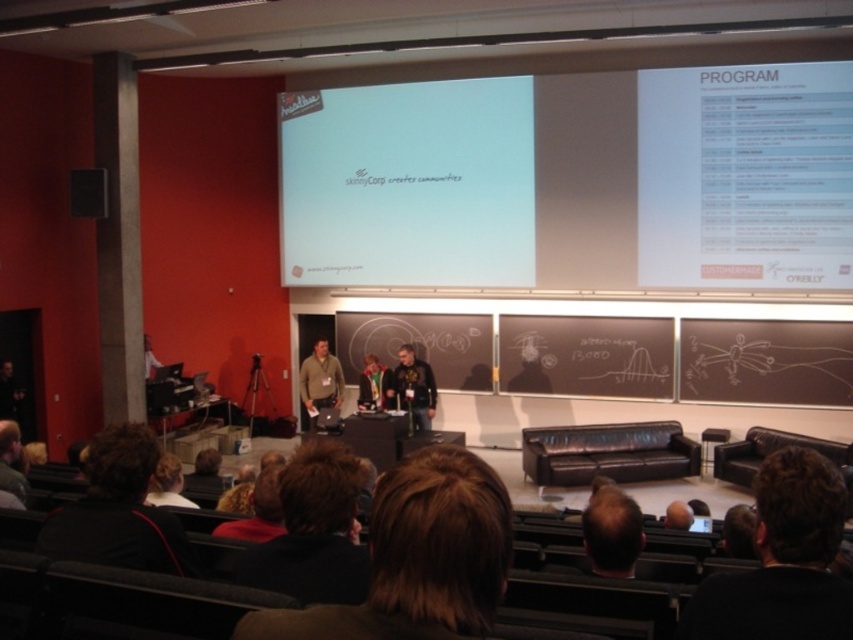
You are an attendee at the conference and want to take a photo of the brown hair at lower right. The camera you have can only focus on objects within a 0.1 radius of the point you select. If you choose to focus at point (782, 561), will the brown hair at lower right be in focus?

The brown hair at lower right is located at point (782, 561), so focusing at that point will ensure it is in focus.

You are an attendee in the audience and want to walk to the stage. There are two points marked in the room. One is at point (791, 451) and the other is at point (71, 179). Which point is closer to the stage?

Point (791, 451) is in front of point (71, 179), so it is closer to the stage.